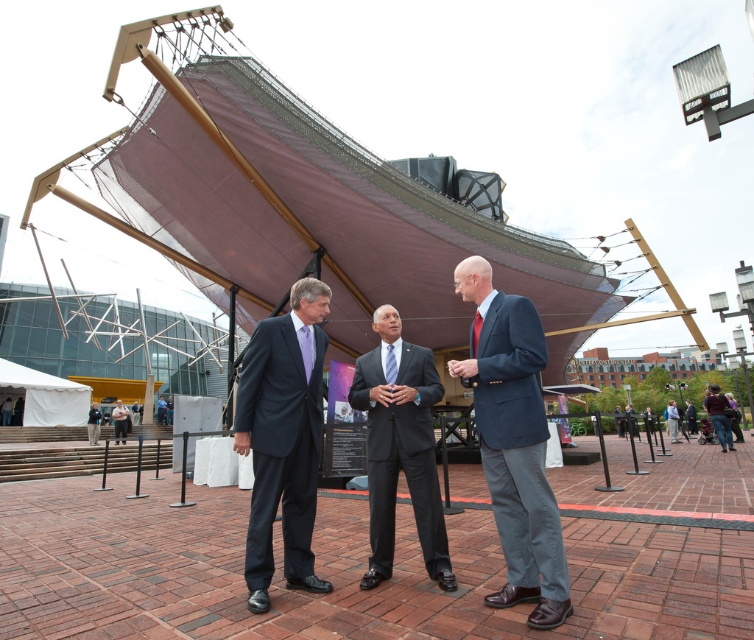
Question: Among these objects, which one is farthest from the camera?

Choices:
 (A) matte black suit at center
 (B) dark blue suit at center
 (C) matte navy blazer at center

Answer: (B)

Question: Does matte navy blazer at center lie behind matte black suit at center?

Choices:
 (A) no
 (B) yes

Answer: (A)

Question: Which point is farther from the camera taking this photo?

Choices:
 (A) (509, 483)
 (B) (316, 435)

Answer: (B)

Question: Based on their relative distances, which object is farther from the matte black suit at center?

Choices:
 (A) matte navy blazer at center
 (B) dark blue suit at center

Answer: (A)

Question: Can you confirm if matte black suit at center is positioned above dark blue suit at center?

Choices:
 (A) yes
 (B) no

Answer: (A)

Question: Where is matte black suit at center located in relation to dark blue suit at center in the image?

Choices:
 (A) above
 (B) below

Answer: (A)